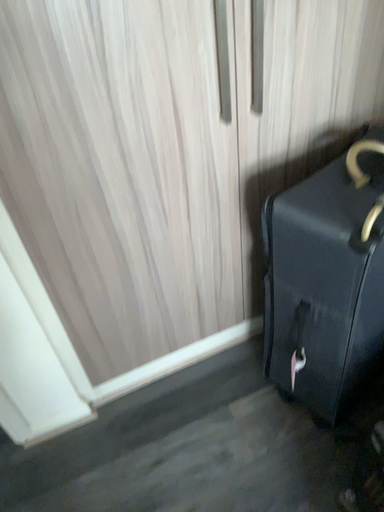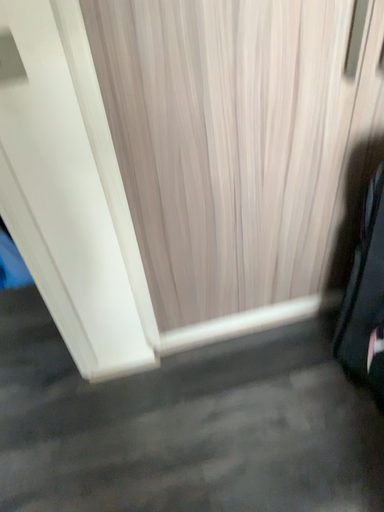
Question: Which way did the camera rotate in the video?

Choices:
 (A) rotated left
 (B) rotated right

Answer: (A)